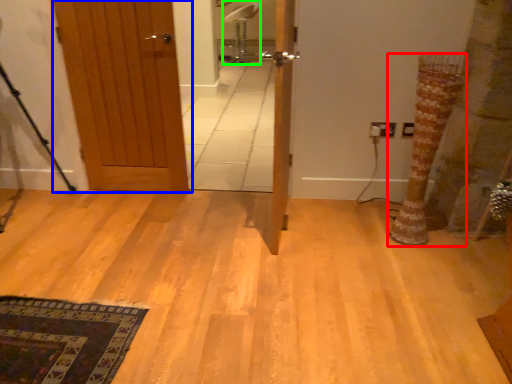
Question: Which object is the closest to the tree trunk (highlighted by a red box)? Choose among these: door (highlighted by a blue box) or chair (highlighted by a green box).

Choices:
 (A) door
 (B) chair

Answer: (A)